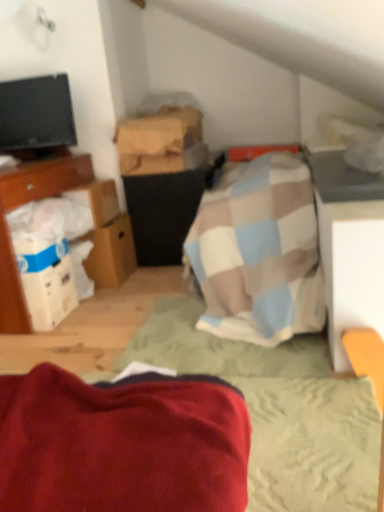
At what (x,y) coordinates should I click in order to perform the action: click on vacant region under brown cardboard box at upper center, the first cardboard box viewed from the top (from a real-world perspective). Please return your answer as a coordinate pair (x, y). The image size is (384, 512). Looking at the image, I should click on (162, 170).